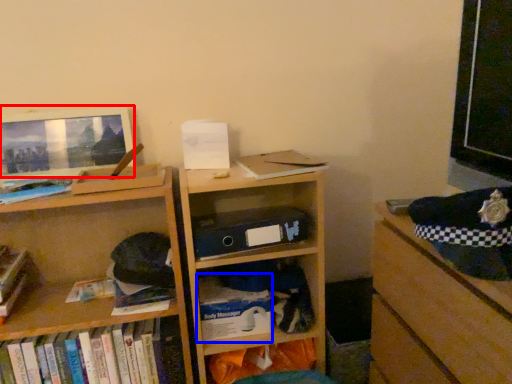
Question: Which object appears farthest to the camera in this image, computer monitor (highlighted by a red box) or paperback book (highlighted by a blue box)?

Choices:
 (A) computer monitor
 (B) paperback book

Answer: (B)